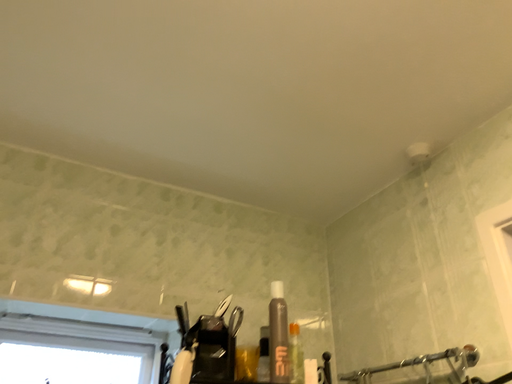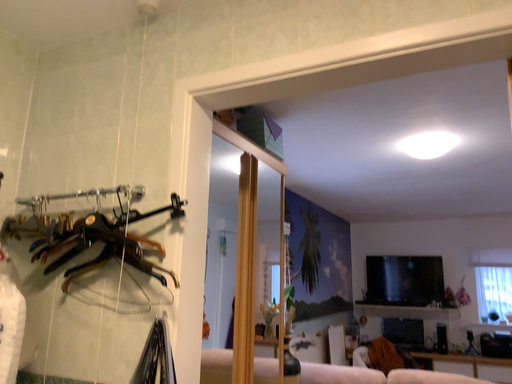
Question: How did the camera likely rotate when shooting the video?

Choices:
 (A) rotated right
 (B) rotated left

Answer: (A)